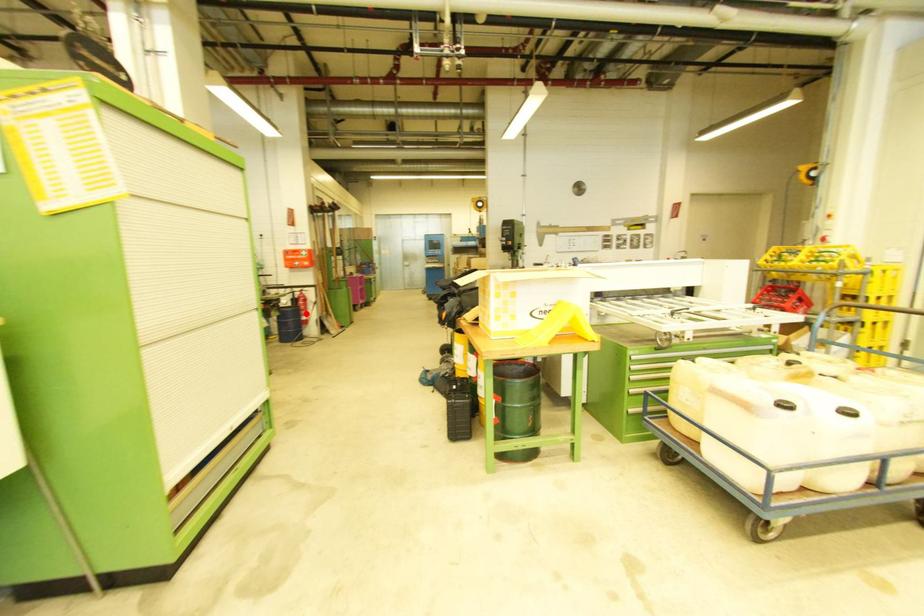
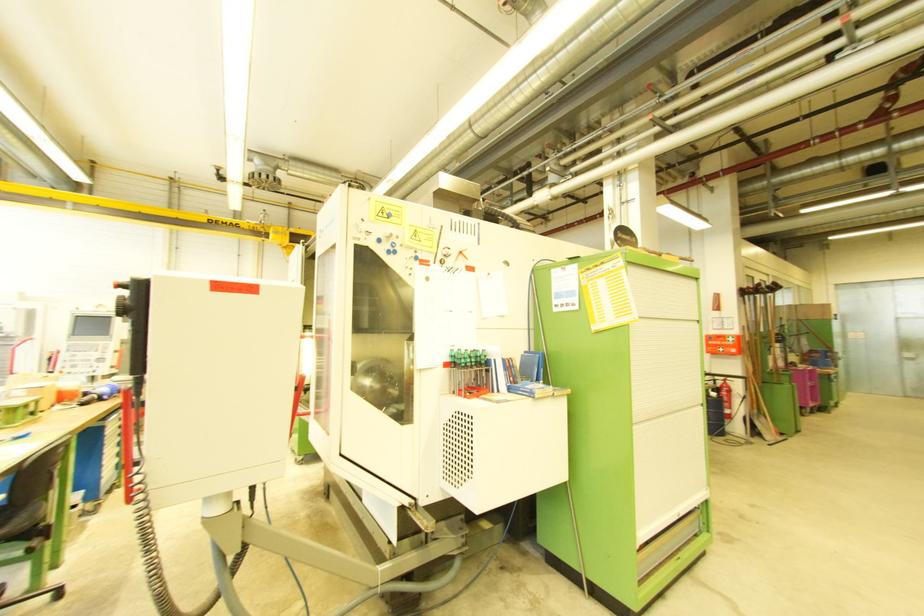
Question: I am providing you with two images of the same scene from different viewpoints. A red point is shown in image1. For the corresponding object point in image2, is it positioned nearer or farther from the camera?

Choices:
 (A) Nearer
 (B) Farther

Answer: (B)